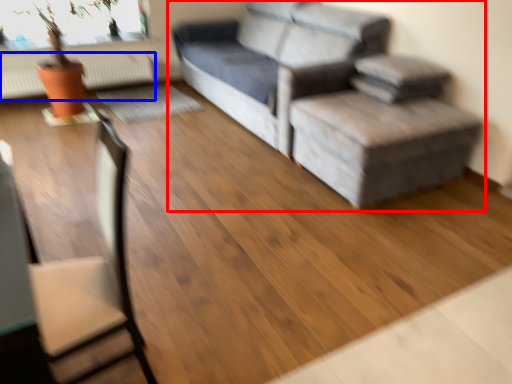
Question: Which of the following is the closest to the observer, studio couch (highlighted by a red box) or radiator (highlighted by a blue box)?

Choices:
 (A) studio couch
 (B) radiator

Answer: (A)